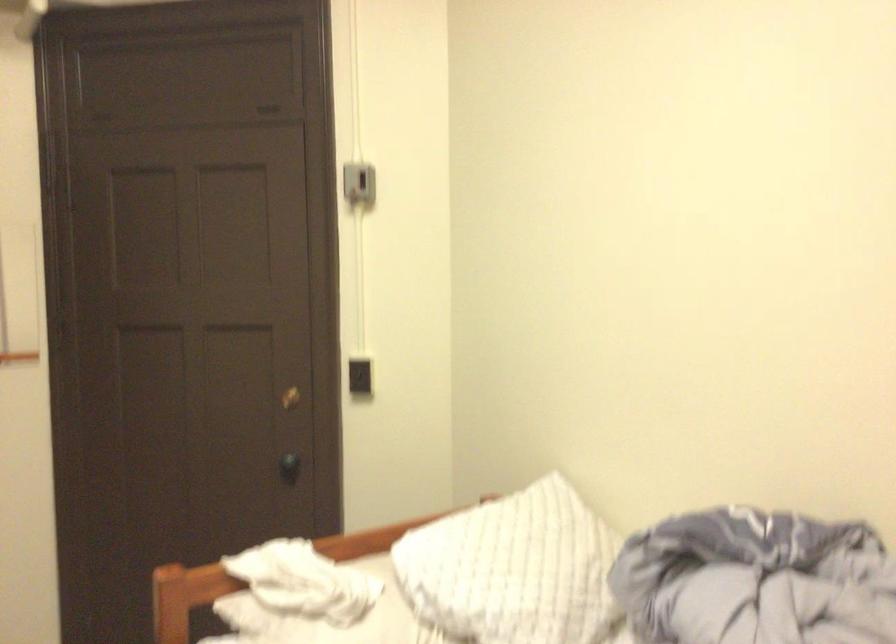
Find where to turn the brass door lock. Please return your answer as a coordinate pair (x, y).

(289, 398)